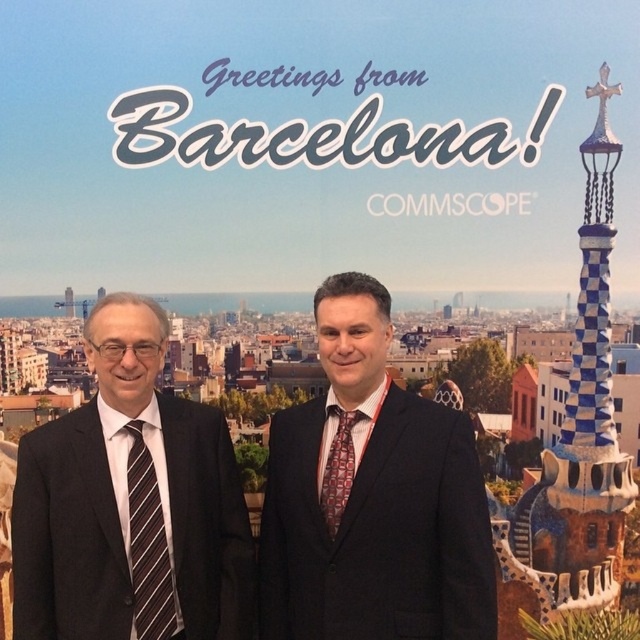
Is black suit at center closer to the viewer compared to matte black suit at center?

Yes, black suit at center is in front of matte black suit at center.

Find the location of a particular element. The width and height of the screenshot is (640, 640). black suit at center is located at coordinates 244,502.

Is point (428, 545) closer to camera compared to point (140, 570)?

No, (428, 545) is further to viewer.

Between point (269, 560) and point (173, 621), which one is positioned behind?

The point (269, 560) is behind.

This screenshot has width=640, height=640. What are the coordinates of `matte black suit at center` in the screenshot? It's located at (371, 497).

Can you confirm if black suit at center is positioned to the left of black striped tie at left?

Incorrect, black suit at center is not on the left side of black striped tie at left.

Which of these two, black suit at center or black striped tie at left, stands taller?

Standing taller between the two is black suit at center.

Describe the element at coordinates (244, 502) in the screenshot. This screenshot has height=640, width=640. I see `black suit at center` at that location.

Where is `black suit at center`? The height and width of the screenshot is (640, 640). black suit at center is located at coordinates (244, 502).